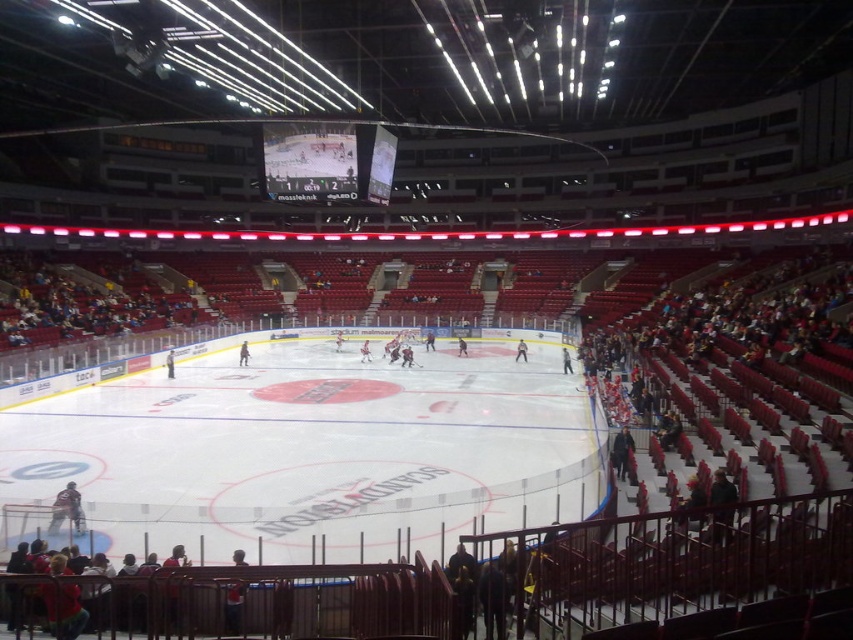
Question: Which of the following is the closest to the observer?

Choices:
 (A) matte digital scoreboard at center
 (B) white smooth ice at center

Answer: (B)

Question: Is white smooth ice at center smaller than matte digital scoreboard at center?

Choices:
 (A) no
 (B) yes

Answer: (A)

Question: Which point is farther to the camera?

Choices:
 (A) (421, 451)
 (B) (309, 180)

Answer: (B)

Question: Can you confirm if white smooth ice at center is positioned above matte digital scoreboard at center?

Choices:
 (A) yes
 (B) no

Answer: (B)

Question: Does white smooth ice at center have a larger size compared to matte digital scoreboard at center?

Choices:
 (A) yes
 (B) no

Answer: (A)